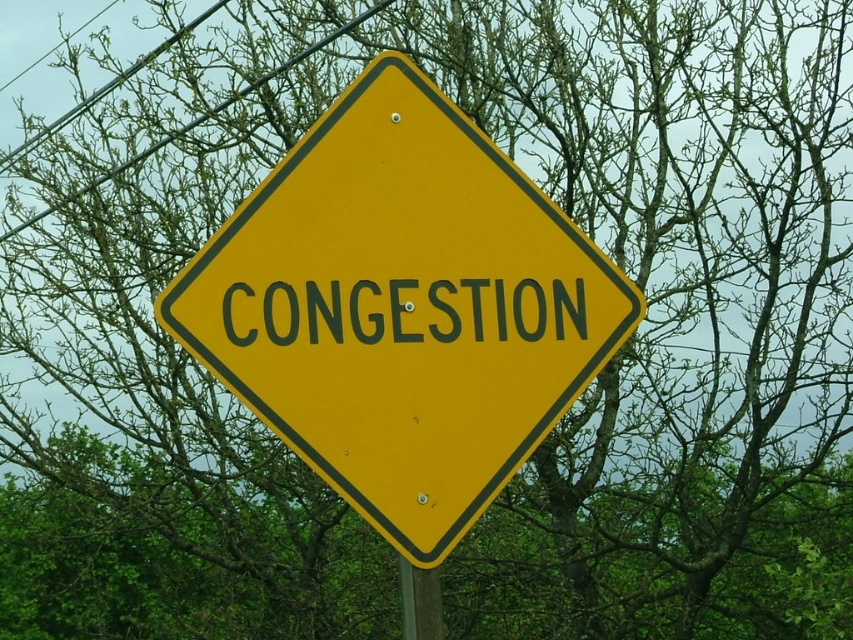
Does metallic wire at upper left have a lesser height compared to green wood pole at lower center?

No.

Can you confirm if metallic wire at upper left is wider than green wood pole at lower center?

Yes.

Find the location of a particular element. metallic wire at upper left is located at coordinates (199, 116).

Between yellow matte/concrete sign at center and green wood pole at lower center, which one has less height?

green wood pole at lower center

Between point (248, 356) and point (427, 625), which one is positioned behind?

The point (427, 625) is behind.

Which is behind, point (434, 333) or point (437, 624)?

Positioned behind is point (437, 624).

You are a GUI agent. You are given a task and a screenshot of the screen. Output one action in this format:
    pyautogui.click(x=<x>, y=<y>)
    Task: Click on the yellow matte/concrete sign at center
    This screenshot has height=640, width=853.
    Given the screenshot: What is the action you would take?
    pyautogui.click(x=402, y=308)

Is yellow matte/concrete sign at center smaller than metallic wire at upper left?

Yes.

Does point (469, 419) come closer to viewer compared to point (213, 108)?

That is True.

This screenshot has height=640, width=853. I want to click on yellow matte/concrete sign at center, so pyautogui.click(x=402, y=308).